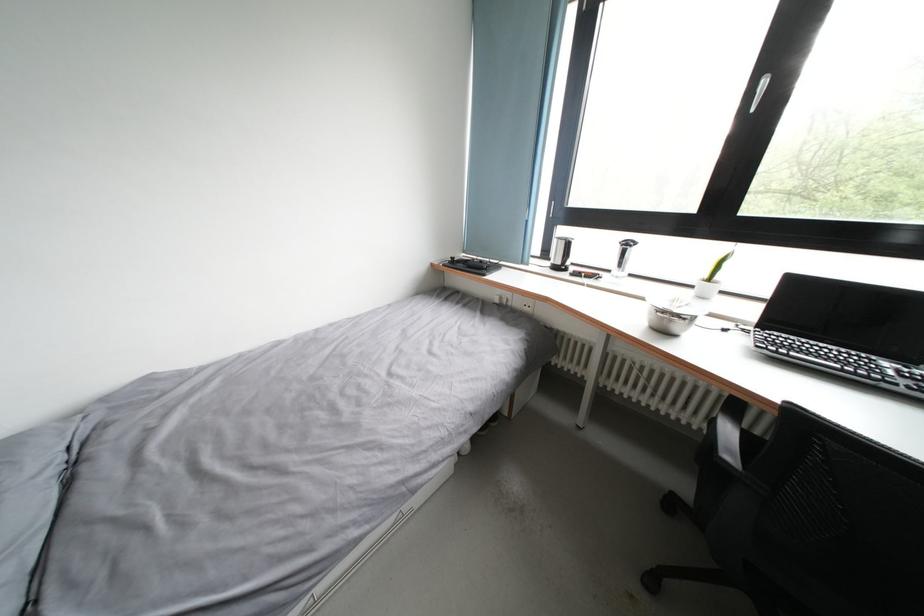
Identify the location of black kettle handle. This screenshot has height=616, width=924. (561, 253).